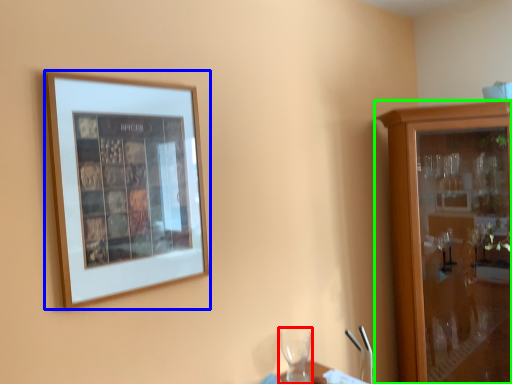
Question: Which object is the farthest from wine glass (highlighted by a red box)? Choose among these: picture frame (highlighted by a blue box) or cabinetry (highlighted by a green box).

Choices:
 (A) picture frame
 (B) cabinetry

Answer: (A)